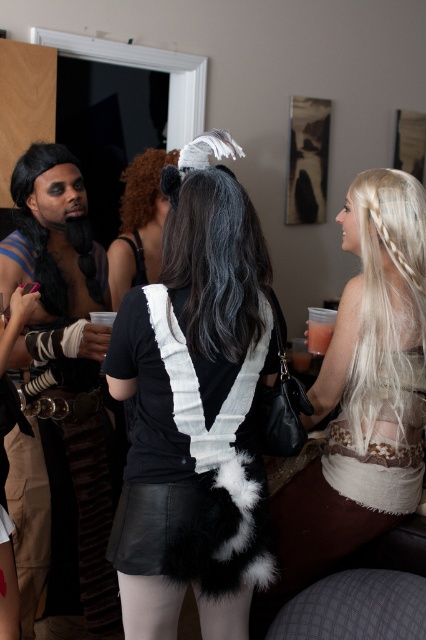
Is point (417, 324) behind point (77, 246)?

No, it is in front of (77, 246).

Does point (394, 182) come closer to viewer compared to point (57, 296)?

That is True.

Find the location of a particular element. The height and width of the screenshot is (640, 426). blonde hair at right is located at coordinates (386, 298).

Is point (333, 442) positioned in front of point (215, 316)?

No, (333, 442) is further to viewer.

Describe the element at coordinates (362, 396) in the screenshot. I see `satin white dress at right` at that location.

At what (x,y) coordinates should I click in order to perform the action: click on satin white dress at right. Please return your answer as a coordinate pair (x, y). This screenshot has width=426, height=640. Looking at the image, I should click on (362, 396).

Between point (348, 195) and point (132, 268), which one is positioned behind?

The point (132, 268) is behind.

Who is positioned more to the left, satin white dress at right or black fur headband at center?

Positioned to the left is black fur headband at center.

This screenshot has height=640, width=426. Identify the location of satin white dress at right. (362, 396).